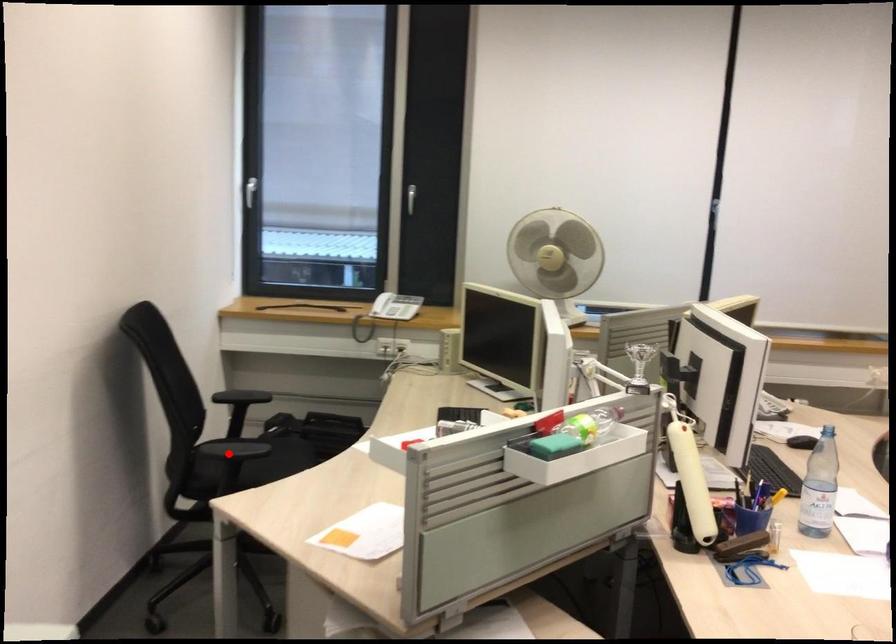
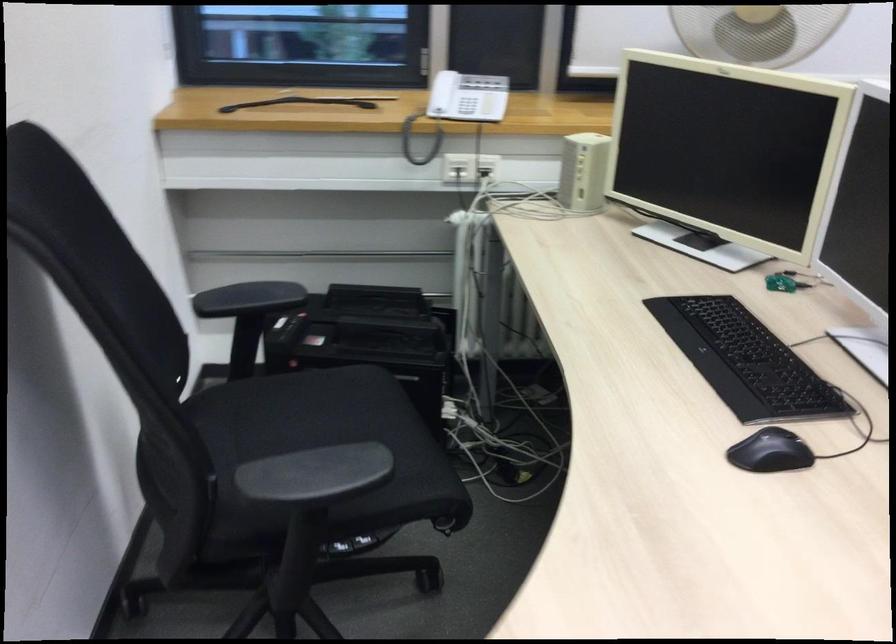
The point at the highlighted location is marked in the first image. Where is the corresponding point in the second image?

(315, 475)